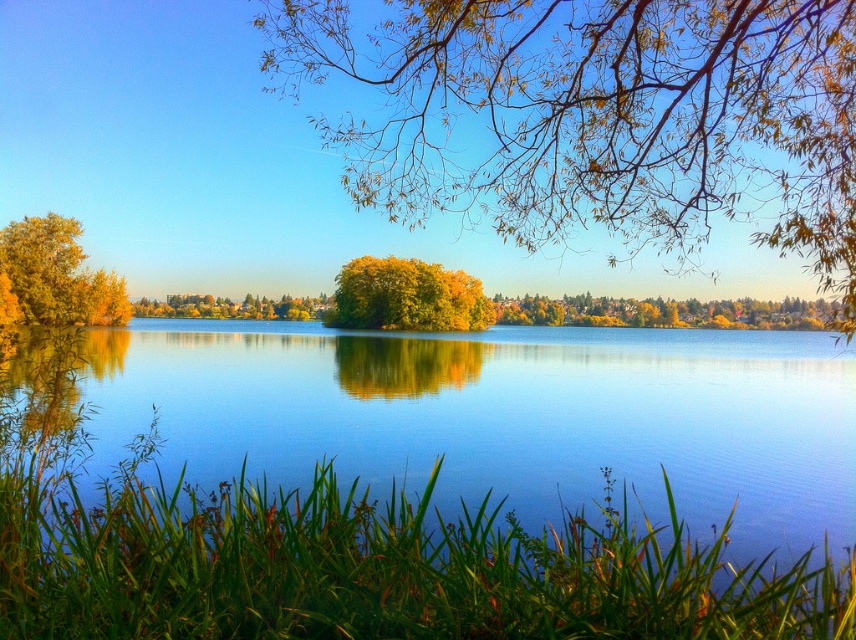
You are standing at the lakeside and notice a specific point marked on the image. What object is located at the coordinates point (x=364, y=563)?

The point (x=364, y=563) indicates green leafy grass at lower center.

You are standing at the lakeside and want to take a photo of both point (539, 620) and point (123, 314). Which point should you focus on first to ensure both are in clear view?

Point (539, 620) is closer to the camera than point (123, 314), so you should focus on point (539, 620) first to ensure both are in clear view.